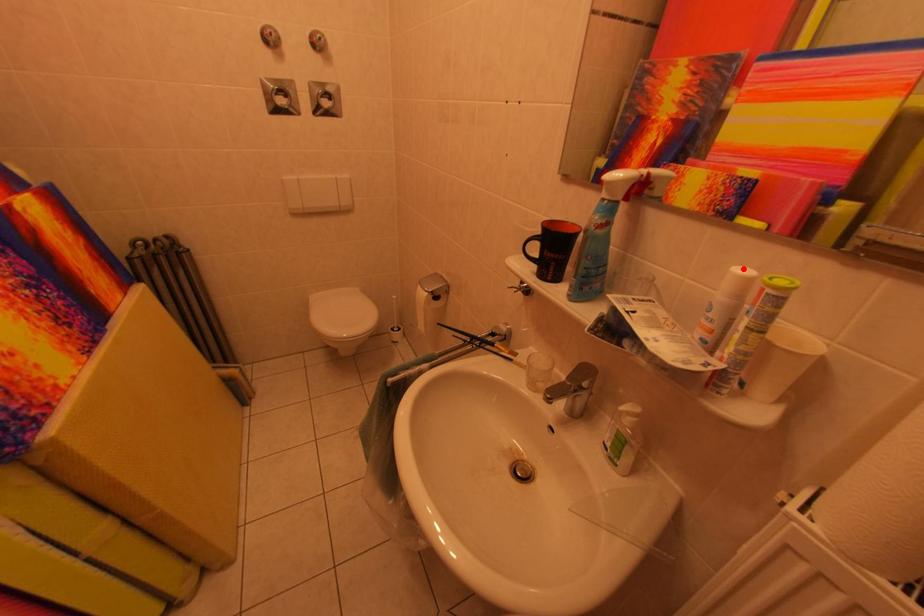
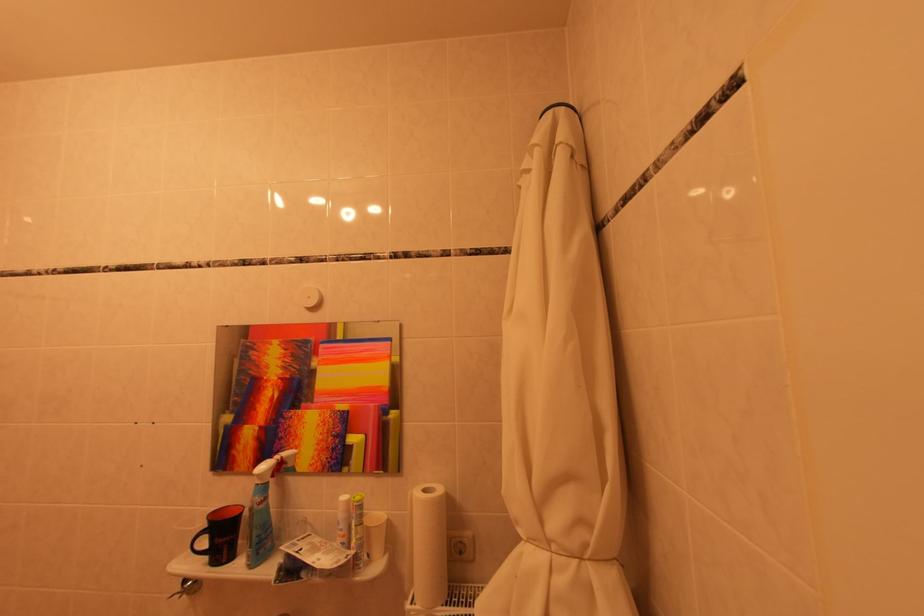
The point at the highlighted location is marked in the first image. Where is the corresponding point in the second image?

(349, 500)